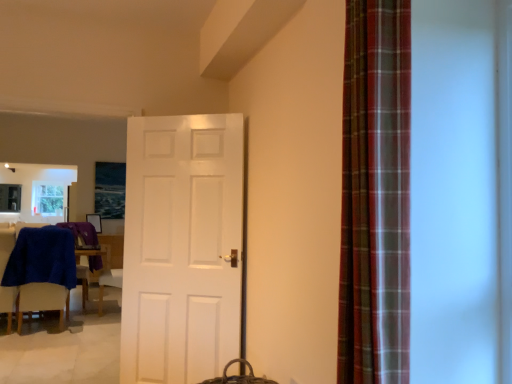
Question: Is white matte door at center aimed at plaid fabric curtain at right?

Choices:
 (A) yes
 (B) no

Answer: (B)

Question: Does white matte door at center appear on the right side of plaid fabric curtain at right?

Choices:
 (A) yes
 (B) no

Answer: (B)

Question: From a real-world perspective, is white matte door at center positioned over plaid fabric curtain at right based on gravity?

Choices:
 (A) no
 (B) yes

Answer: (A)

Question: Is white matte door at center at the left side of plaid fabric curtain at right?

Choices:
 (A) yes
 (B) no

Answer: (A)

Question: Can you confirm if white matte door at center is thinner than plaid fabric curtain at right?

Choices:
 (A) yes
 (B) no

Answer: (A)

Question: Would you say white matte door at center is a long distance from plaid fabric curtain at right?

Choices:
 (A) yes
 (B) no

Answer: (A)

Question: From the image's perspective, does plaid fabric curtain at right appear higher than white matte door at center?

Choices:
 (A) no
 (B) yes

Answer: (B)

Question: Would you say plaid fabric curtain at right contains white matte door at center?

Choices:
 (A) no
 (B) yes

Answer: (A)

Question: Considering the relative sizes of plaid fabric curtain at right and white matte door at center in the image provided, is plaid fabric curtain at right bigger than white matte door at center?

Choices:
 (A) no
 (B) yes

Answer: (A)

Question: From a real-world perspective, does plaid fabric curtain at right sit lower than white matte door at center?

Choices:
 (A) yes
 (B) no

Answer: (B)

Question: Could you tell me if plaid fabric curtain at right is turned towards white matte door at center?

Choices:
 (A) yes
 (B) no

Answer: (B)

Question: Does plaid fabric curtain at right have a smaller size compared to white matte door at center?

Choices:
 (A) no
 (B) yes

Answer: (B)

Question: Does plaid fabric curtain at right lie in front of blue fabric chair at left?

Choices:
 (A) yes
 (B) no

Answer: (A)